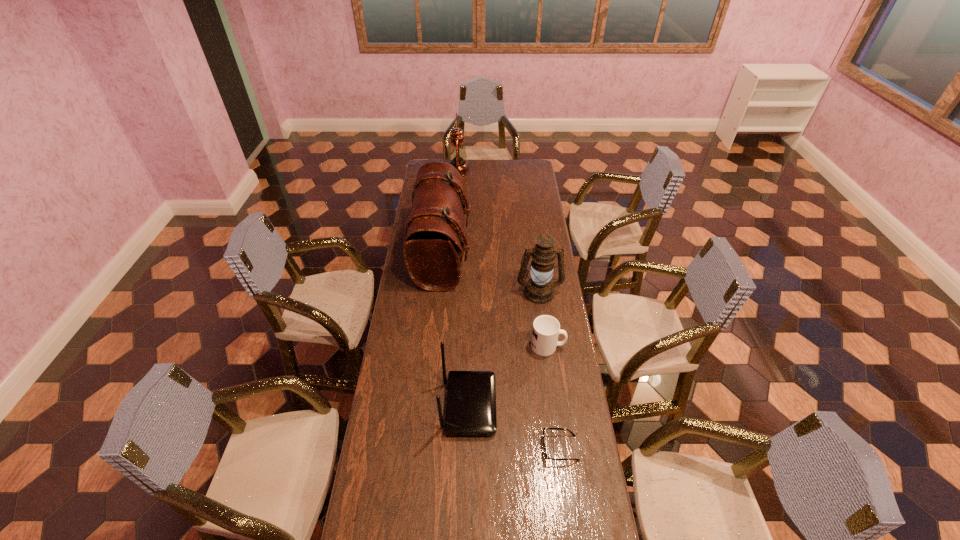
The image size is (960, 540). What are the coordinates of `the left oil lamp` in the screenshot? It's located at (457, 155).

I want to click on the farther oil lamp, so click(457, 155).

Where is `satchel`? The height and width of the screenshot is (540, 960). satchel is located at coordinates (433, 241).

What are the coordinates of `the right oil lamp` in the screenshot? It's located at (539, 289).

In order to click on the fourth shortest object in this screenshot , I will do `click(539, 289)`.

Find the location of a particular element. the third shortest object is located at coordinates (471, 395).

At what (x,y) coordinates should I click in order to perform the action: click on the fifth tallest object. Please return your answer as a coordinate pair (x, y). The height and width of the screenshot is (540, 960). Looking at the image, I should click on (546, 329).

Where is `mug`? The width and height of the screenshot is (960, 540). mug is located at coordinates (546, 329).

Find the location of a particular element. The image size is (960, 540). spectacles is located at coordinates (547, 458).

The image size is (960, 540). I want to click on vacant space located 0.400m on the front of the left oil lamp, so point(455,219).